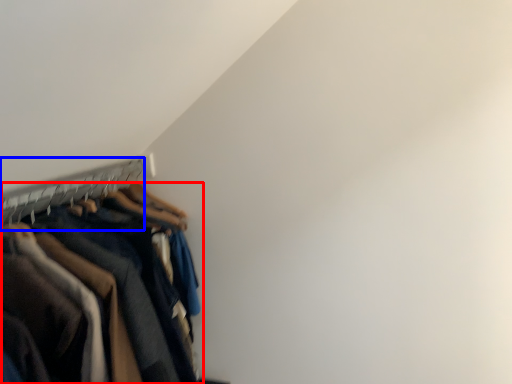
Question: Among these objects, which one is farthest to the camera, trousers (highlighted by a red box) or hanger (highlighted by a blue box)?

Choices:
 (A) trousers
 (B) hanger

Answer: (B)